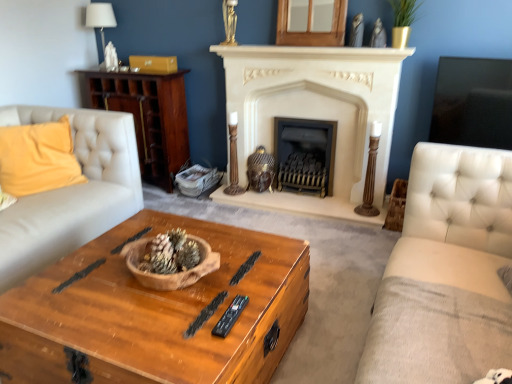
Question: From the image's perspective, is brown textured pine cone at center above or below yellow fabric pillow at left?

Choices:
 (A) below
 (B) above

Answer: (A)

Question: From a real-world perspective, is brown textured pine cone at center above or below yellow fabric pillow at left?

Choices:
 (A) above
 (B) below

Answer: (B)

Question: Which object is positioned closest to the brown textured pine cone at center?

Choices:
 (A) white stone fireplace at center, marked as the first fireplace in a left-to-right arrangement
 (B) black metal fireplace at center, the second fireplace positioned from the left
 (C) white fabric lampshade at upper left
 (D) white tufted fabric studio couch at right
 (E) black plastic remote at center

Answer: (E)

Question: Estimate the real-world distances between objects in this image. Which object is closer to the white fabric lampshade at upper left?

Choices:
 (A) wooden cabinet at left
 (B) black plastic remote at center
 (C) black metal fireplace at center, acting as the first fireplace starting from the right
 (D) brown textured pine cone at center
 (E) white stone fireplace at center, marked as the first fireplace in a left-to-right arrangement

Answer: (A)